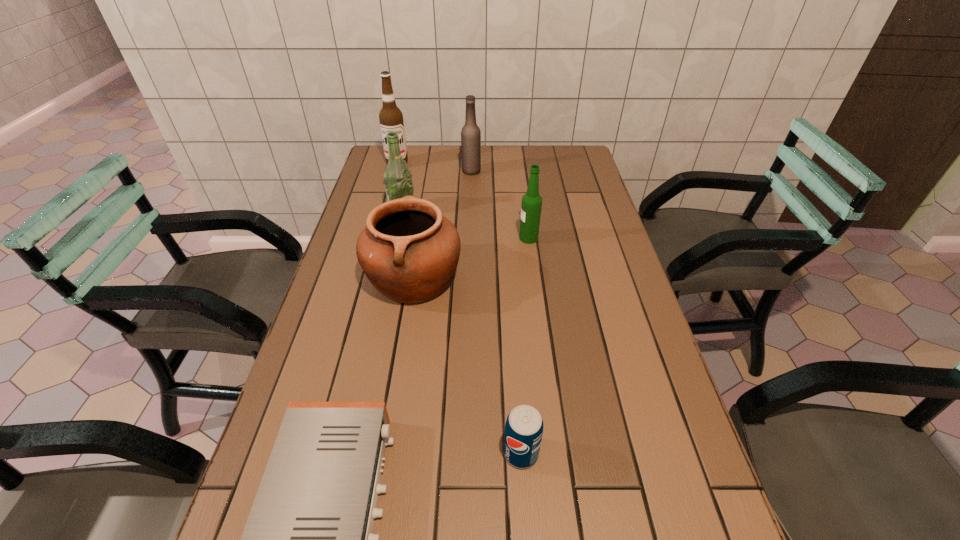
Locate an element on the screen. unoccupied position between the fifth farthest object and the pop is located at coordinates (468, 365).

Where is `unoccupied position between the tallest object and the fourth nearest object`? The width and height of the screenshot is (960, 540). unoccupied position between the tallest object and the fourth nearest object is located at coordinates [463, 201].

Where is `object that stands as the fifth closest to the third shortest object`? The height and width of the screenshot is (540, 960). object that stands as the fifth closest to the third shortest object is located at coordinates (470, 134).

I want to click on object that is the sixth closest to the tallest object, so [524, 426].

Identify which beer bottle is located as the second nearest to the second nearest beer bottle. Please provide its 2D coordinates. Your answer should be formatted as a tuple, i.e. [(x, y)], where the tuple contains the x and y coordinates of a point satisfying the conditions above.

[(531, 205)]

This screenshot has height=540, width=960. I want to click on the closest beer bottle relative to the nearest beer bottle, so click(397, 178).

Where is `free space in the image that satisfies the following two spatial constraints: 1. on the surface of the third shortest object; 2. on the right side of the third farthest object`? The width and height of the screenshot is (960, 540). free space in the image that satisfies the following two spatial constraints: 1. on the surface of the third shortest object; 2. on the right side of the third farthest object is located at coordinates (387, 278).